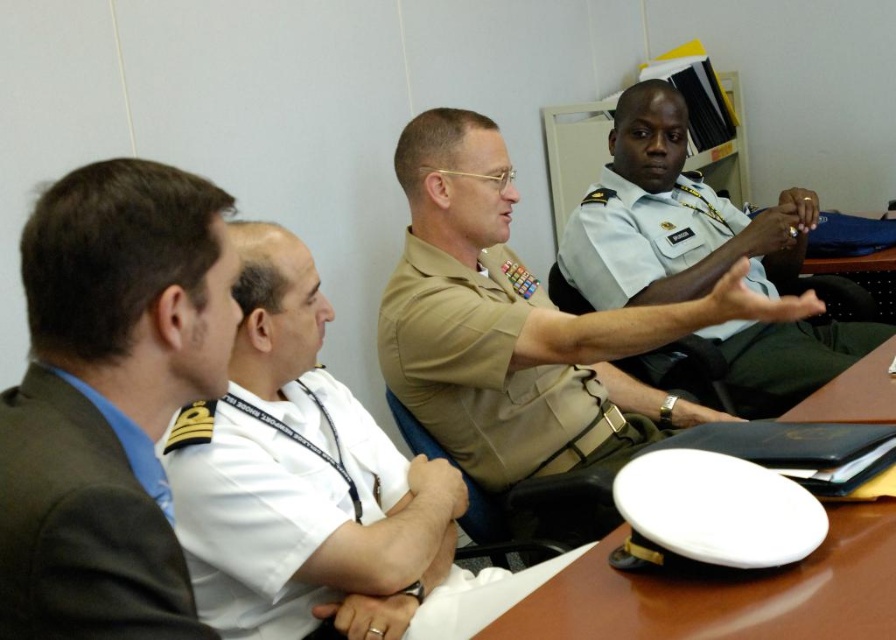
Can you confirm if black fabric uniform at left is positioned to the right of white matte hat at center?

In fact, black fabric uniform at left is to the left of white matte hat at center.

Does black fabric uniform at left have a larger size compared to white matte hat at center?

No.

Describe the element at coordinates (83, 524) in the screenshot. I see `black fabric uniform at left` at that location.

Image resolution: width=896 pixels, height=640 pixels. What are the coordinates of `black fabric uniform at left` in the screenshot? It's located at (83, 524).

Which of these two, tan uniform at center or black fabric uniform at left, stands taller?

tan uniform at center

Does tan uniform at center have a larger size compared to black fabric uniform at left?

Indeed, tan uniform at center has a larger size compared to black fabric uniform at left.

Locate an element on the screen. tan uniform at center is located at coordinates (518, 324).

Is point (309, 307) closer to viewer compared to point (821, 406)?

Yes, it is.

Which is in front, point (392, 474) or point (806, 570)?

Point (806, 570) is in front.

Locate an element on the screen. The width and height of the screenshot is (896, 640). white uniform at center is located at coordinates 303,477.